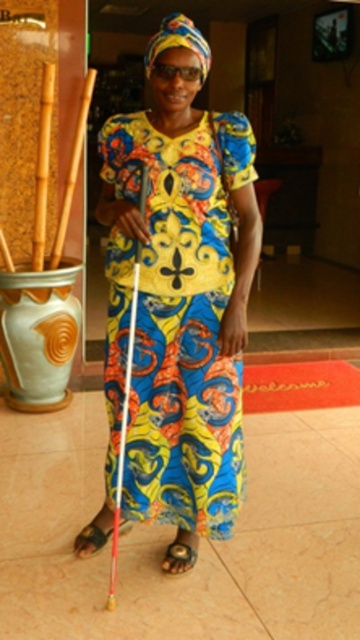
You are a photographer taking a picture of the person in the scene. You notice two points marked in the image. Which point, point (164, 557) or point (91, 532), is closer to the camera?

Point (164, 557) is closer to the viewer than point (91, 532).

You are an interior designer planning to place a decorative item on a shelf next to the matte colorful dress at center and the brown leather sandal at lower left. Which object should you choose to ensure it fits well if you want something smaller than both?

You should choose an item smaller than both the matte colorful dress at center and the brown leather sandal at lower left. Since the matte colorful dress at center is bigger than the brown leather sandal at lower left, the smallest option would be the brown leather sandal at lower left. Therefore, select an item smaller than the brown leather sandal at lower left.

You are a fashion designer observing the image of a person wearing a vibrant dress and two leather sandals. You need to determine the spatial relationship between the black leather sandal at lower center and the brown leather sandal at lower left. Which sandal is placed below the other?

The black leather sandal at lower center is positioned under the brown leather sandal at lower left.